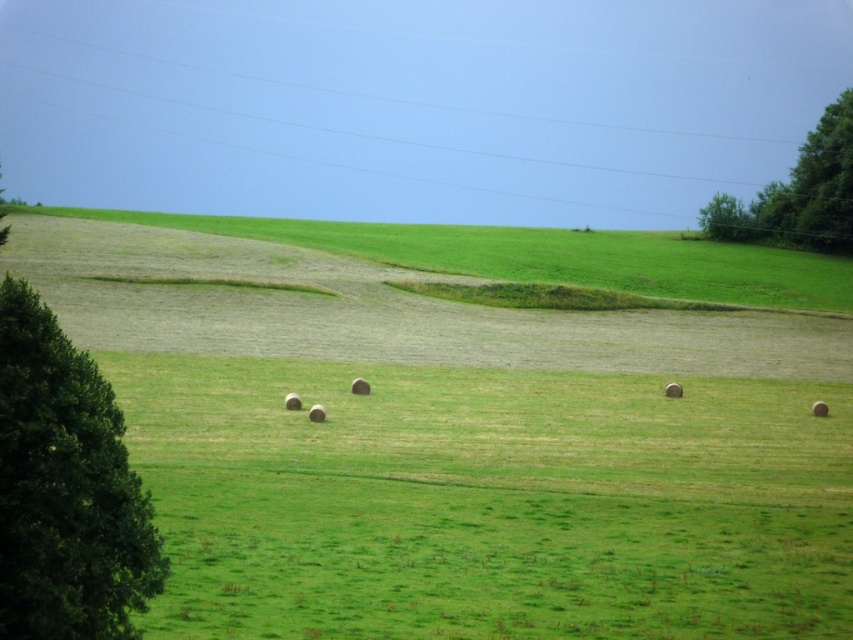
Question: Which of the following is the farthest from the observer?

Choices:
 (A) green grass at center
 (B) green leafy tree at upper right
 (C) green leafy tree at left

Answer: (B)

Question: Is green grass at center positioned before green leafy tree at left?

Choices:
 (A) no
 (B) yes

Answer: (A)

Question: Is green leafy tree at left above green leafy tree at upper right?

Choices:
 (A) yes
 (B) no

Answer: (B)

Question: Does green grass at center have a smaller size compared to green leafy tree at left?

Choices:
 (A) yes
 (B) no

Answer: (B)

Question: Which point is closer to the camera taking this photo?

Choices:
 (A) (701, 490)
 (B) (0, 524)

Answer: (B)

Question: Which of the following is the farthest from the observer?

Choices:
 (A) green leafy tree at upper right
 (B) green grass at center

Answer: (A)